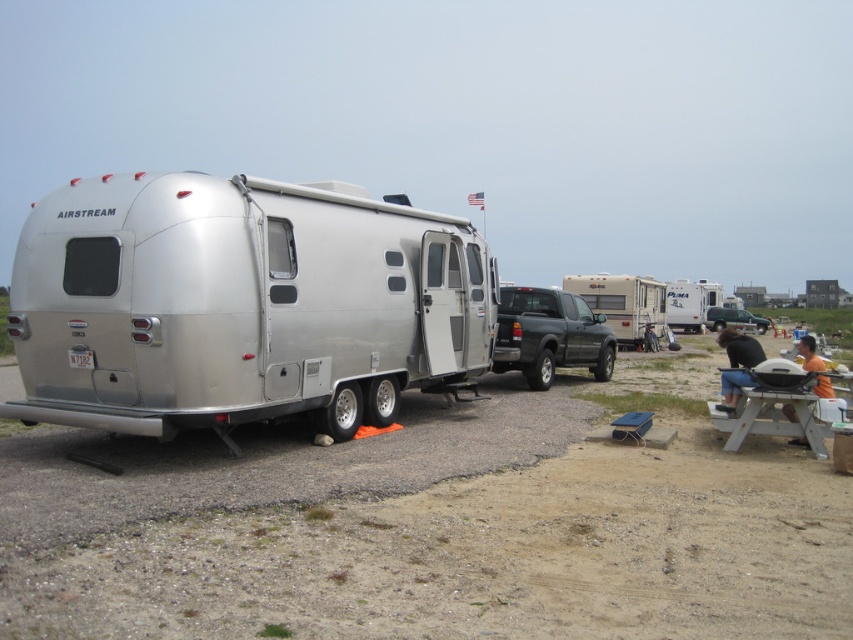
Can you confirm if white plastic camper at center is positioned above metallic silver suv at center?

Yes.

Does point (697, 332) come behind point (712, 330)?

That is False.

Find the location of a particular element. The image size is (853, 640). white plastic camper at center is located at coordinates (689, 304).

In the scene shown: Between matte black truck at center and beige plastic camper at center, which one appears on the left side from the viewer's perspective?

Positioned to the left is matte black truck at center.

Who is shorter, matte black truck at center or beige plastic camper at center?

matte black truck at center

The width and height of the screenshot is (853, 640). Identify the location of matte black truck at center. (549, 336).

Is dirt field at lower center thinner than matte black truck at center?

Incorrect, dirt field at lower center's width is not less than matte black truck at center's.

Who is positioned more to the right, dirt field at lower center or matte black truck at center?

matte black truck at center

This screenshot has width=853, height=640. In order to click on dirt field at lower center in this screenshot , I will do `click(485, 556)`.